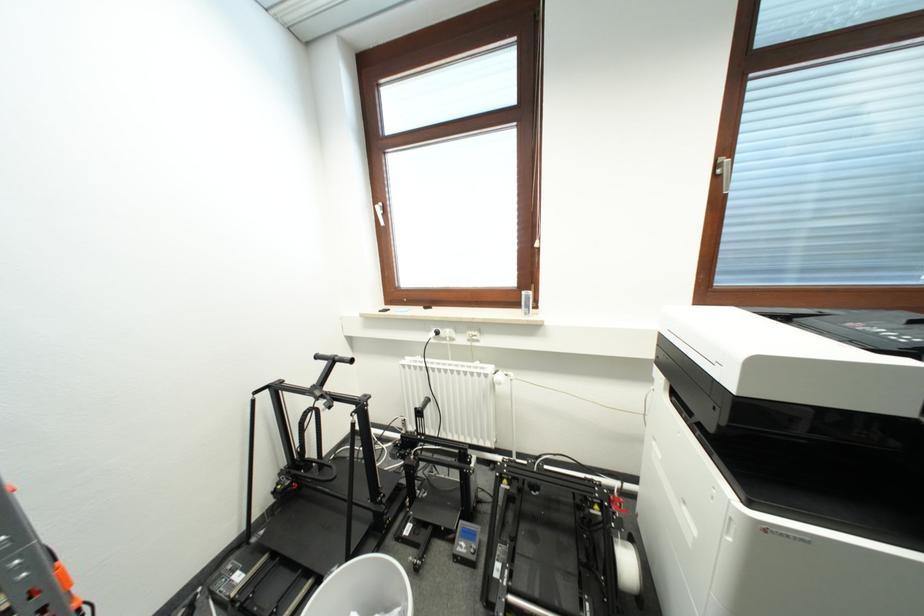
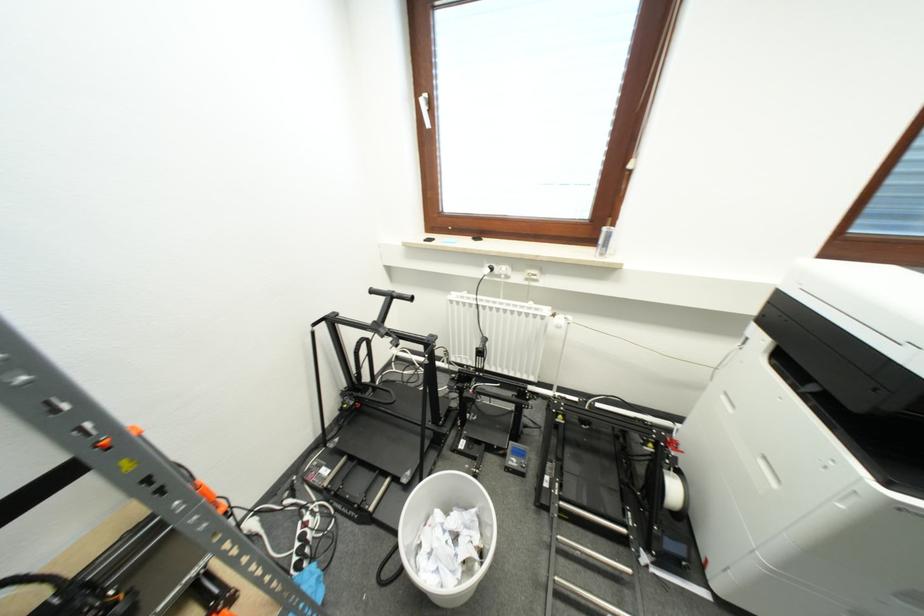
From the picture: The images are taken continuously from a first-person perspective. In which direction are you moving?

The movement direction of the cameraman is left, forward.